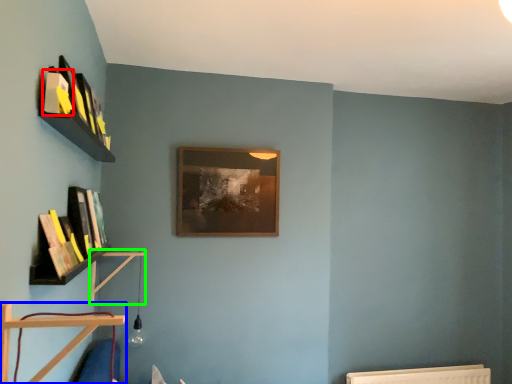
Question: Based on their relative distances, which object is farther from book (highlighted by a red box)? Choose from shelf (highlighted by a blue box) and shelf (highlighted by a green box).

Choices:
 (A) shelf
 (B) shelf

Answer: (B)